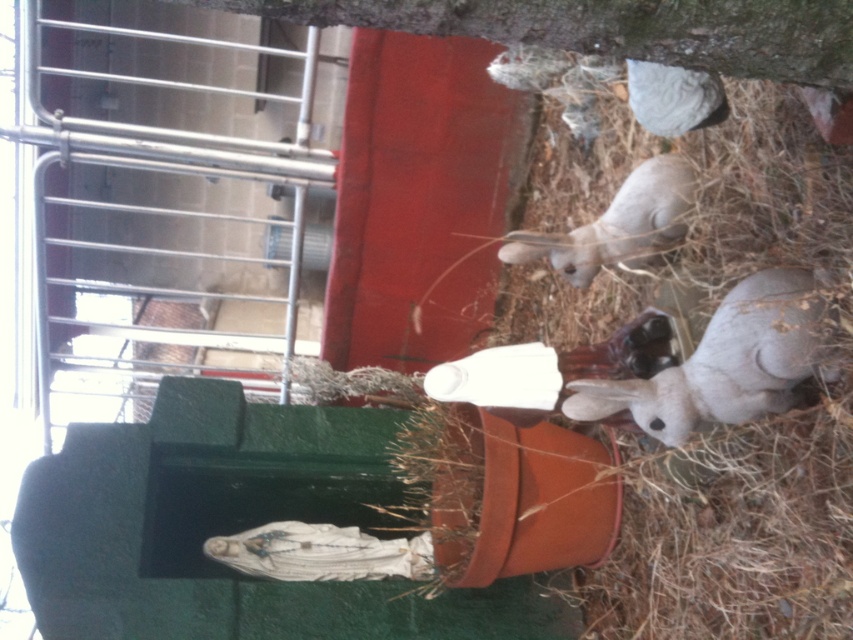
You are standing in the enclosure and want to place a small item at the point closer to you between point (708, 392) and point (672, 204). Which point should you aim for?

You should aim for point (708, 392) because it is closer to you than point (672, 204).

You are a farmer checking the rabbits in their enclosure. You notice two rabbits at the lower right of the image. Which rabbit has a wider body? The options are the gray matte rabbit at lower right and the fuzzy gray rabbit at lower right.

The gray matte rabbit at lower right is wider than the fuzzy gray rabbit at lower right according to the description.